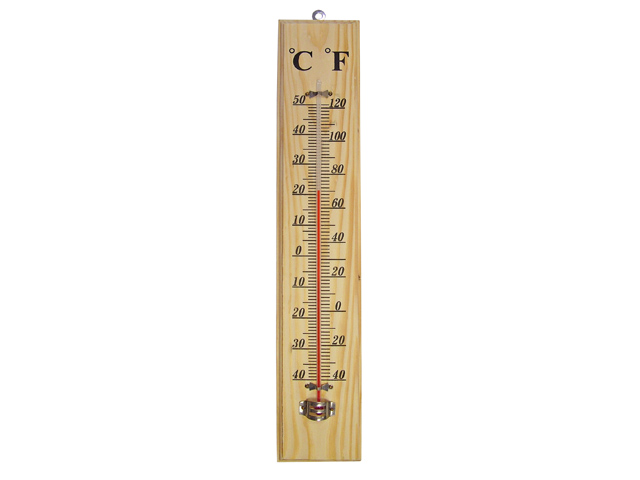
Where is `hook`? This screenshot has width=640, height=480. hook is located at coordinates [319, 15].